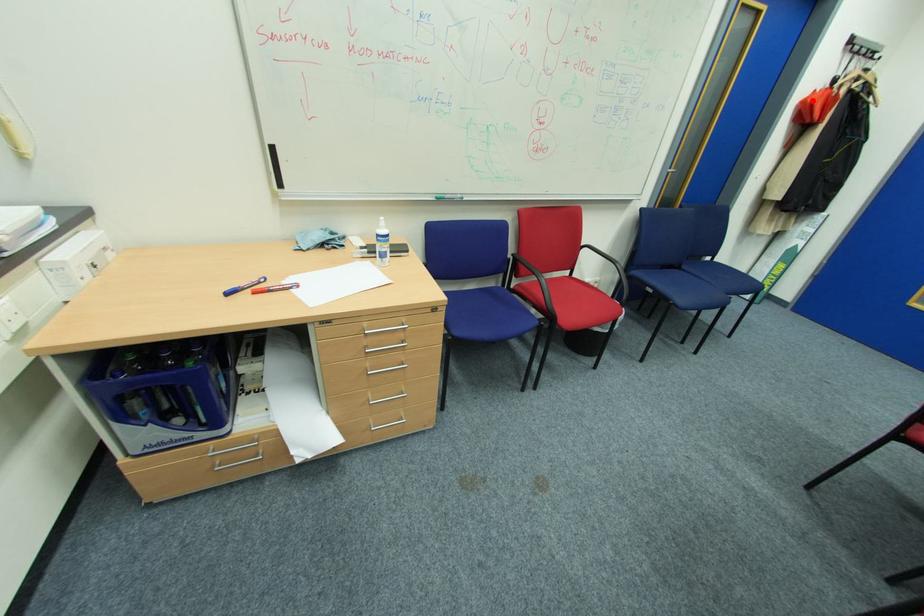
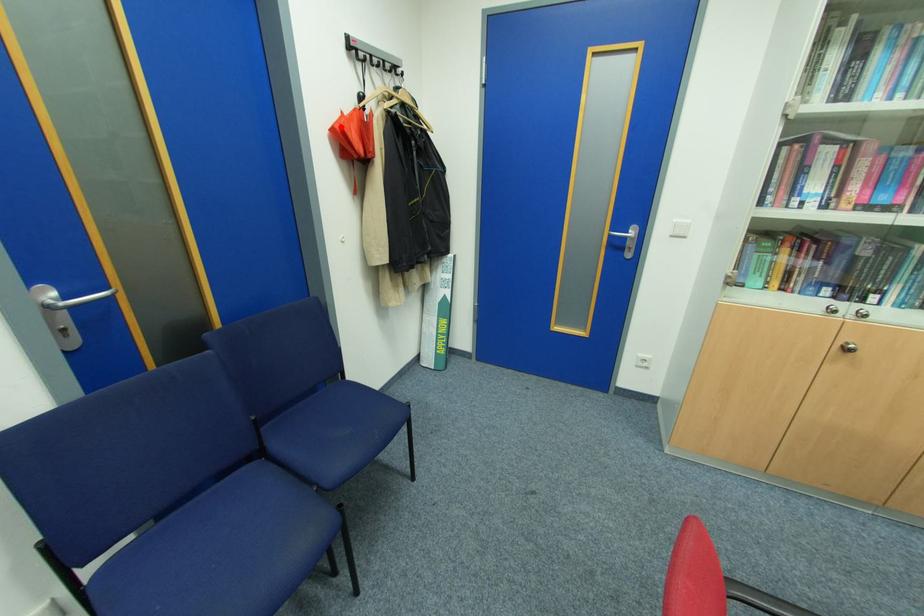
I am providing you with two images of the same scene from different viewpoints. A red point is marked on the first image and another point is marked on the second image. Is the red point in image1 aligned with the point shown in image2?

Yes